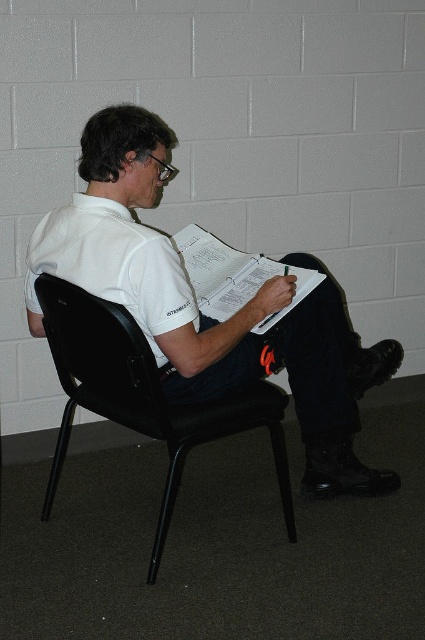
Question: Which point appears farthest from the camera in this image?

Choices:
 (A) (158, 326)
 (B) (107, 316)
 (C) (257, 269)

Answer: (C)

Question: Does white matte shirt at center have a smaller size compared to black plastic chair at center?

Choices:
 (A) yes
 (B) no

Answer: (B)

Question: Can you confirm if white matte shirt at center is positioned to the right of white paper clipboard at center?

Choices:
 (A) yes
 (B) no

Answer: (A)

Question: Based on their relative distances, which object is nearer to the black plastic chair at center?

Choices:
 (A) white matte shirt at center
 (B) white paper clipboard at center

Answer: (A)

Question: Among these objects, which one is farthest from the camera?

Choices:
 (A) white paper clipboard at center
 (B) black plastic chair at center

Answer: (A)

Question: Considering the relative positions of black plastic chair at center and white paper clipboard at center in the image provided, where is black plastic chair at center located with respect to white paper clipboard at center?

Choices:
 (A) left
 (B) right

Answer: (A)